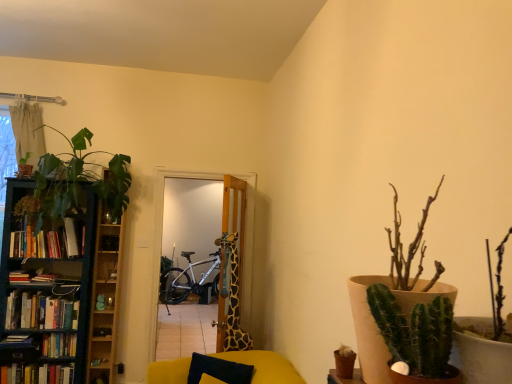
Where is `blank space situated above hardcover book at left, the 3th book when ordered from bottom to top (from a real-world perspective)`? The image size is (512, 384). blank space situated above hardcover book at left, the 3th book when ordered from bottom to top (from a real-world perspective) is located at coordinates (20, 337).